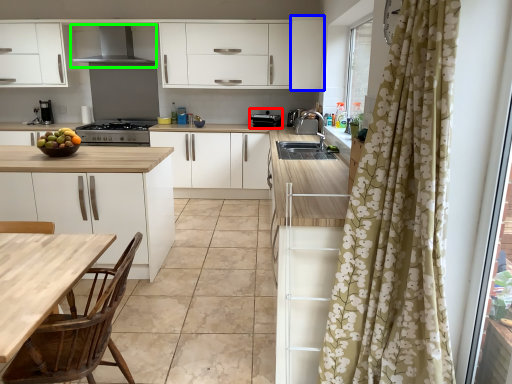
Question: Estimate the real-world distances between objects in this image. Which object is farther from appliance (highlighted by a red box), cabinetry (highlighted by a blue box) or exhaust hood (highlighted by a green box)?

Choices:
 (A) cabinetry
 (B) exhaust hood

Answer: (B)